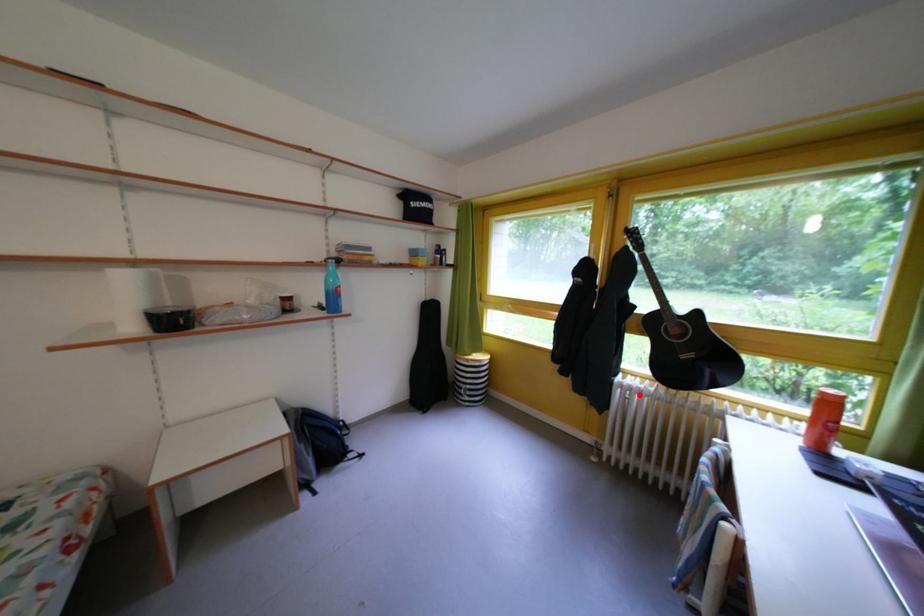
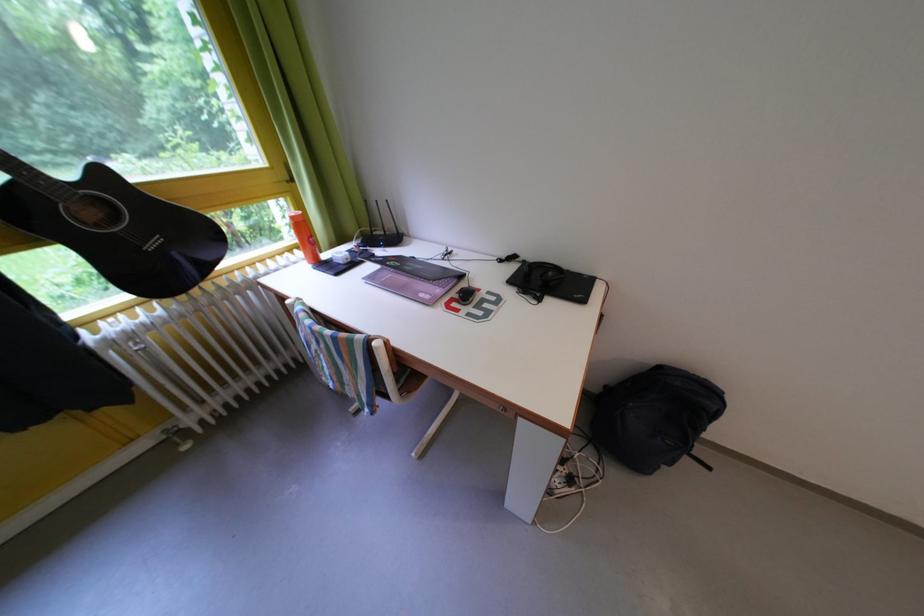
Find the pixel in the second image that matches the highlighted location in the first image.

(140, 342)